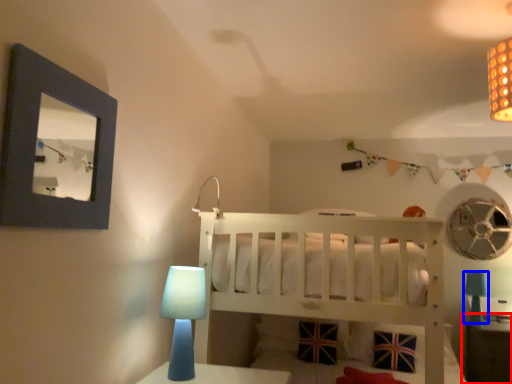
Question: Which of the following is the closest to the observer, table (highlighted by a red box) or table lamp (highlighted by a blue box)?

Choices:
 (A) table
 (B) table lamp

Answer: (A)